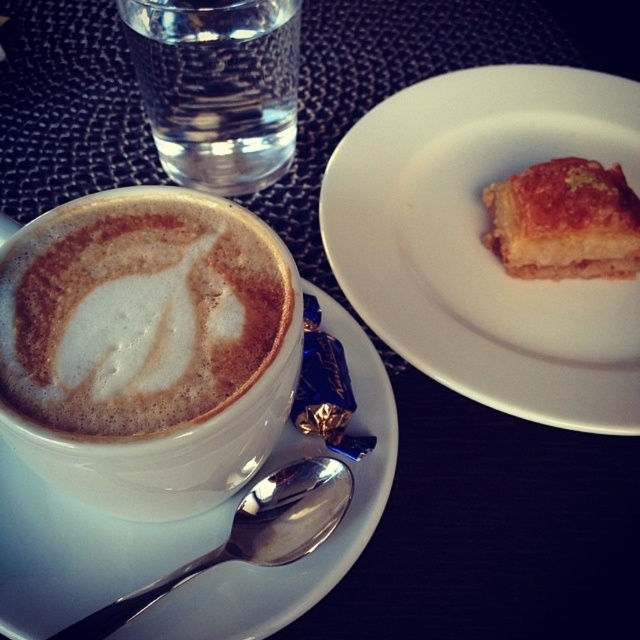
Question: Can you confirm if golden brown flaky pastry at upper right is positioned below silver metallic spoon at lower left?

Choices:
 (A) no
 (B) yes

Answer: (A)

Question: Which point is farther to the camera?

Choices:
 (A) (262, 636)
 (B) (147, 86)
 (C) (324, 518)
 (D) (616, 237)

Answer: (B)

Question: Which object appears farthest from the camera in this image?

Choices:
 (A) clear glass water at upper left
 (B) white ceramic saucer at lower left

Answer: (A)

Question: Which point appears closest to the camera in this image?

Choices:
 (A) (368, 205)
 (B) (291, 545)
 (C) (173, 147)
 (D) (22, 349)

Answer: (D)

Question: Does white ceramic saucer at lower left have a smaller size compared to golden brown flaky pastry at upper right?

Choices:
 (A) no
 (B) yes

Answer: (A)

Question: Can you confirm if golden-brown flaky pastry at upper right is wider than white ceramic saucer at lower left?

Choices:
 (A) no
 (B) yes

Answer: (B)